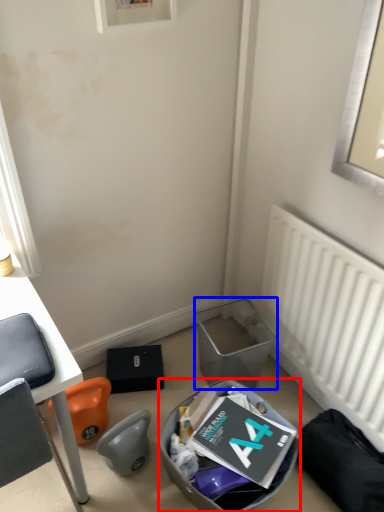
Question: Which object appears farthest to the camera in this image, trash bin/can (highlighted by a red box) or trash bin/can (highlighted by a blue box)?

Choices:
 (A) trash bin/can
 (B) trash bin/can

Answer: (B)